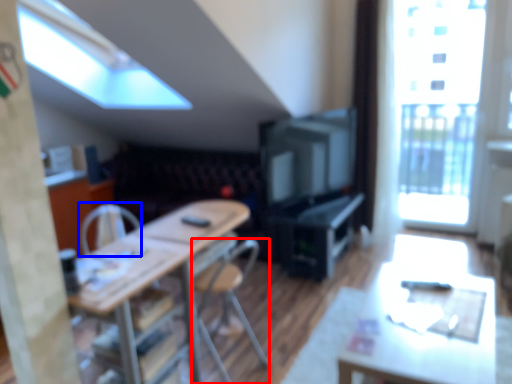
Question: Which point is further to the camera, chair (highlighted by a red box) or armchair (highlighted by a blue box)?

Choices:
 (A) chair
 (B) armchair

Answer: (B)